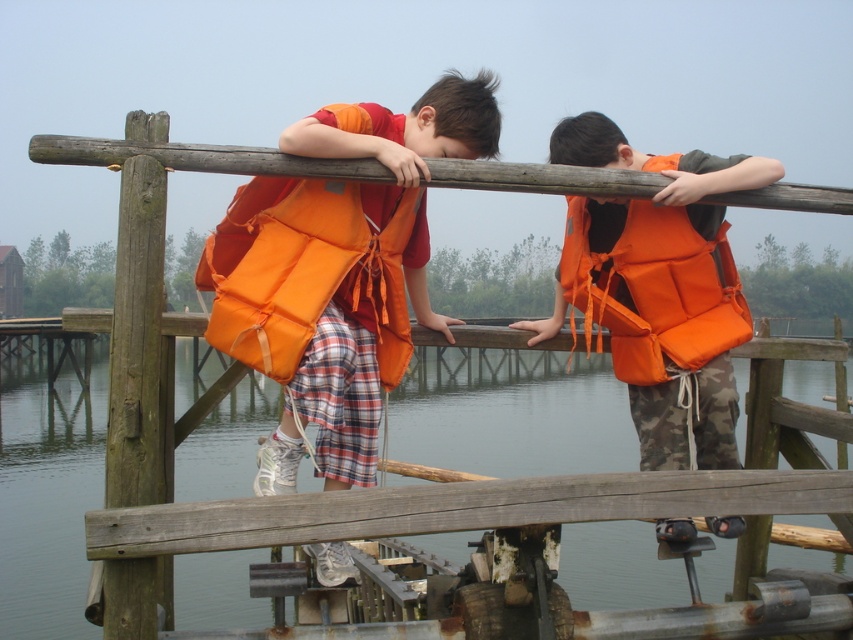
Question: Can you confirm if transparent water at center is positioned below orange fabric life jacket at upper right?

Choices:
 (A) yes
 (B) no

Answer: (A)

Question: Is the position of transparent water at center more distant than that of orange matte life jacket at upper center?

Choices:
 (A) yes
 (B) no

Answer: (B)

Question: Which point is closer to the camera?

Choices:
 (A) (465, 92)
 (B) (308, 508)
 (C) (664, 326)

Answer: (B)

Question: Which object is closer to the camera taking this photo?

Choices:
 (A) matte orange life vest at upper center
 (B) orange life vest at upper right
 (C) orange fabric life jacket at upper right

Answer: (A)

Question: Which object is closer to the camera taking this photo?

Choices:
 (A) matte orange life vest at upper center
 (B) transparent water at center

Answer: (B)

Question: Is smooth wooden beam at center above orange fabric life jacket at upper right?

Choices:
 (A) yes
 (B) no

Answer: (B)